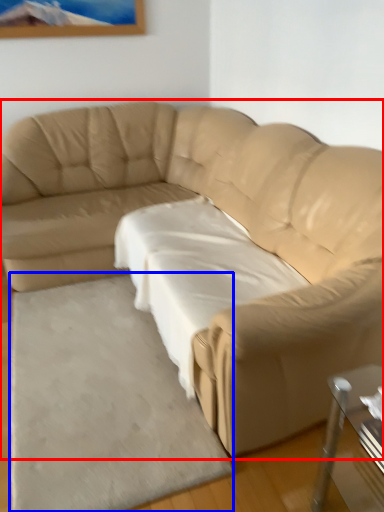
Question: Which of the following is the farthest to the observer, studio couch (highlighted by a red box) or mat (highlighted by a blue box)?

Choices:
 (A) studio couch
 (B) mat

Answer: (B)